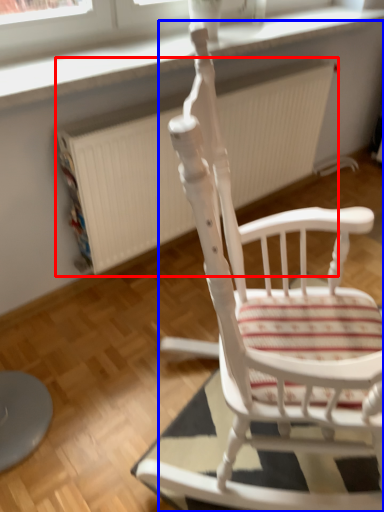
Question: Among these objects, which one is farthest to the camera, radiator (highlighted by a red box) or chair (highlighted by a blue box)?

Choices:
 (A) radiator
 (B) chair

Answer: (A)